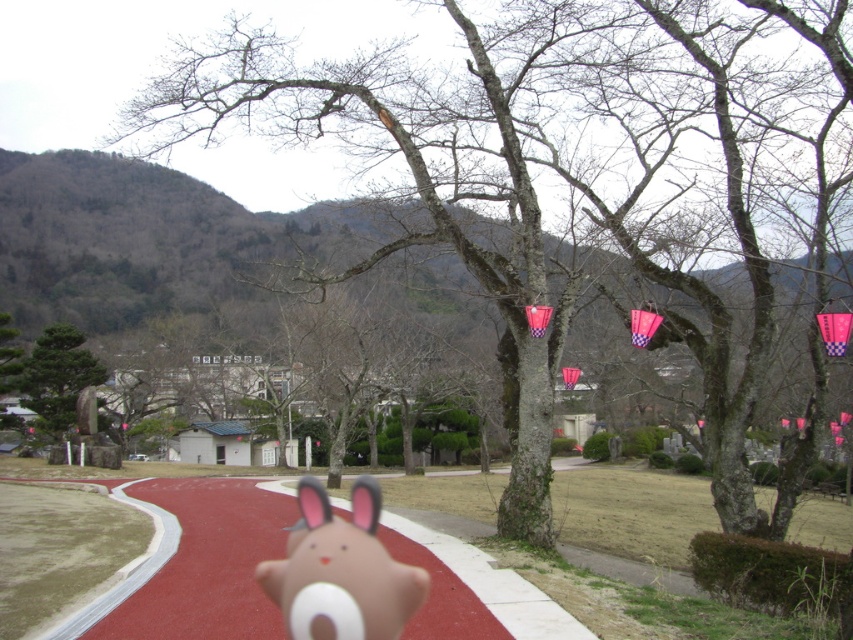
Which of these two, red rubber path at center or white matte plush toy at center, stands shorter?

Standing shorter between the two is red rubber path at center.

Between red rubber path at center and white matte plush toy at center, which one is positioned higher?

red rubber path at center is higher up.

Is point (219, 488) positioned in front of point (366, 486)?

Yes, it is in front of point (366, 486).

Locate an element on the screen. red rubber path at center is located at coordinates (195, 564).

In the scene shown: Is red rubber path at center shorter than green matte stone at left?

In fact, red rubber path at center may be taller than green matte stone at left.

Based on the photo, between red rubber path at center and green matte stone at left, which one appears on the right side from the viewer's perspective?

From the viewer's perspective, red rubber path at center appears more on the right side.

Find the location of a particular element. The image size is (853, 640). red rubber path at center is located at coordinates (195, 564).

Is point (408, 586) closer to camera compared to point (57, 378)?

Yes.

Is point (270, 595) closer to viewer compared to point (91, 356)?

Yes, point (270, 595) is in front of point (91, 356).

I want to click on white matte plush toy at center, so click(341, 570).